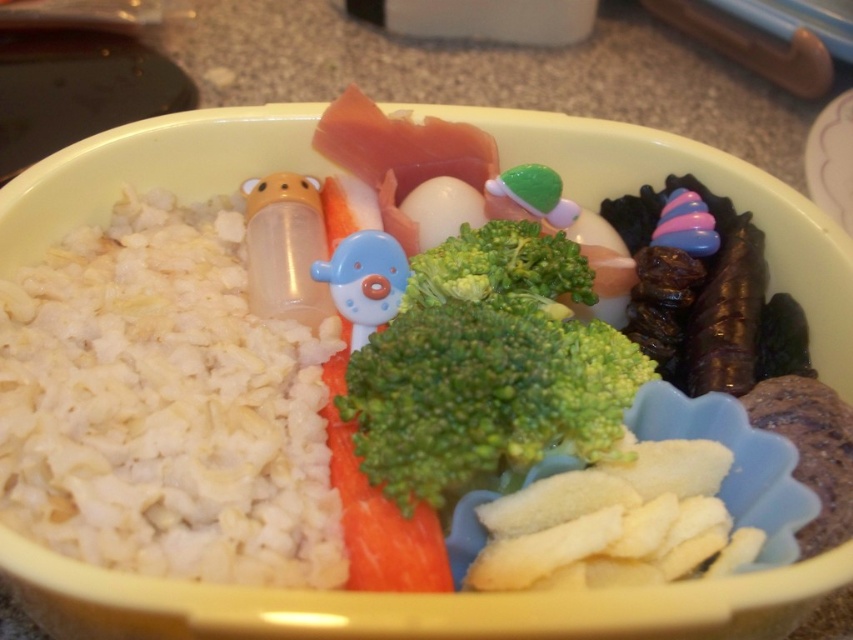
Question: Among these points, which one is nearest to the camera?

Choices:
 (A) (392, 582)
 (B) (653, 372)

Answer: (A)

Question: Which object appears farthest from the camera in this image?

Choices:
 (A) white fluffy rice at left
 (B) green fresh broccoli at center
 (C) green fresh carrot at center
 (D) green matte broccoli at center

Answer: (D)

Question: Does green fresh broccoli at center have a greater width compared to green fresh carrot at center?

Choices:
 (A) no
 (B) yes

Answer: (B)

Question: Is white fluffy rice at left wider than green fresh broccoli at center?

Choices:
 (A) no
 (B) yes

Answer: (B)

Question: Which point is closer to the camera?

Choices:
 (A) green fresh carrot at center
 (B) green matte broccoli at center

Answer: (A)

Question: From the image, what is the correct spatial relationship of white fluffy rice at left in relation to green fresh broccoli at center?

Choices:
 (A) left
 (B) right

Answer: (A)